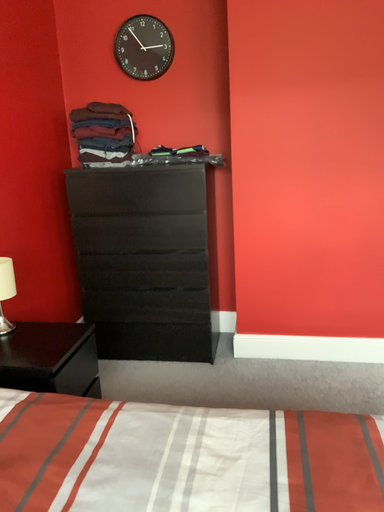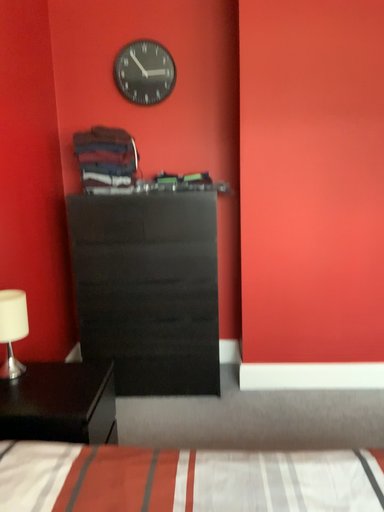
Question: Which way did the camera rotate in the video?

Choices:
 (A) rotated left
 (B) rotated right

Answer: (B)